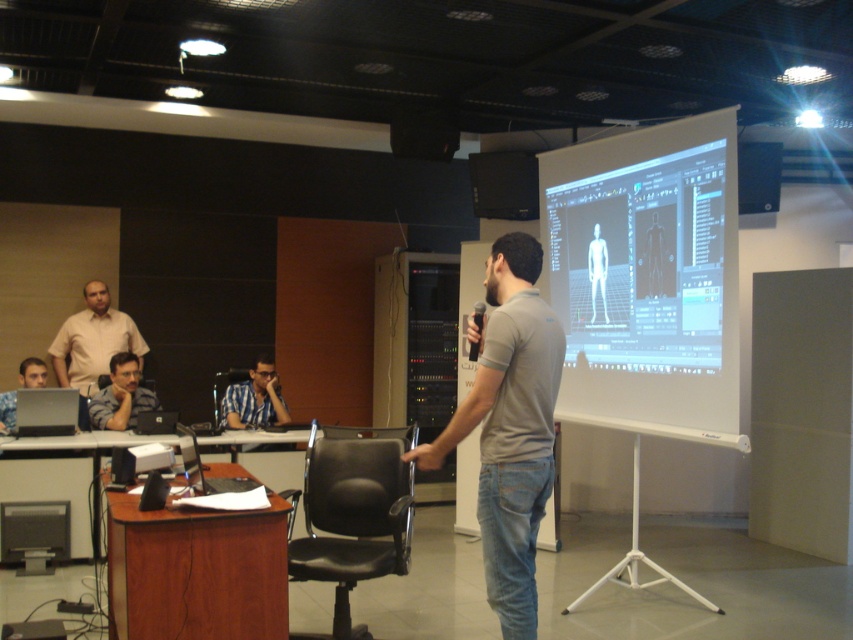
Between point (387, 472) and point (80, 392), which one is positioned behind?

Point (80, 392)

Measure the distance between black leather swivel chair at center and camera.

They are 3.09 meters apart.

At what (x,y) coordinates should I click in order to perform the action: click on black leather swivel chair at center. Please return your answer as a coordinate pair (x, y). The image size is (853, 640). Looking at the image, I should click on (352, 513).

Who is positioned more to the left, gray cotton t-shirt at center or translucent white human figure at center?

Positioned to the left is gray cotton t-shirt at center.

Is point (439, 460) more distant than point (593, 262)?

No, it is not.

Is point (521, 472) positioned in front of point (601, 280)?

Yes, it is in front of point (601, 280).

Locate an element on the screen. The height and width of the screenshot is (640, 853). gray cotton t-shirt at center is located at coordinates (509, 426).

Who is lower down, white matte projection screen at center or matte black laptop at left?

Positioned lower is matte black laptop at left.

Is white matte projection screen at center positioned at the back of matte black laptop at left?

No.

Is point (718, 166) positioned in front of point (15, 406)?

Yes, point (718, 166) is closer to viewer.

Where is `white matte projection screen at center`? This screenshot has height=640, width=853. white matte projection screen at center is located at coordinates (648, 276).